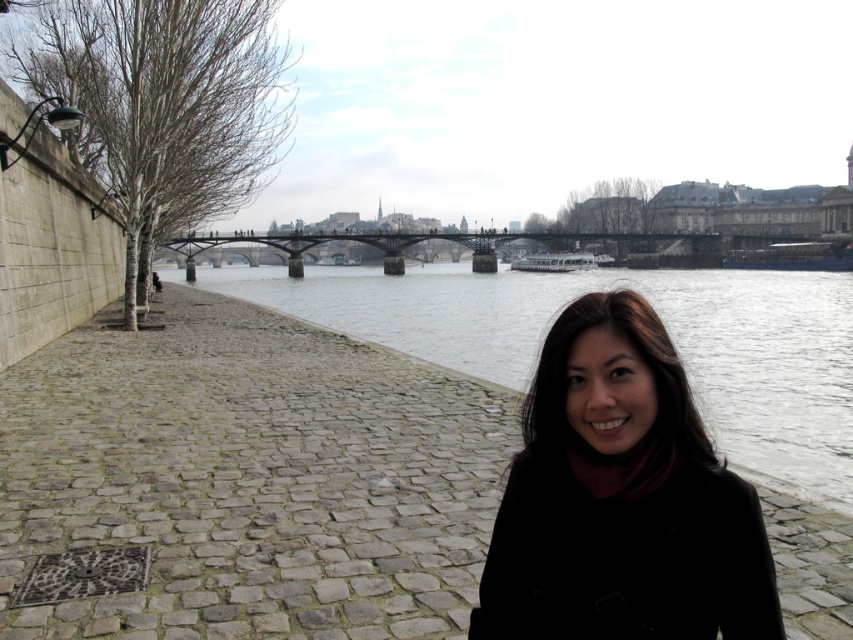
Question: Considering the real-world distances, which object is farthest from the black woolen coat at center?

Choices:
 (A) gray concrete river at center
 (B) metallic bridge at center

Answer: (B)

Question: Which of these objects is positioned farthest from the metallic bridge at center?

Choices:
 (A) black woolen coat at center
 (B) gray concrete river at center

Answer: (A)

Question: Does gray concrete river at center have a lesser width compared to metallic bridge at center?

Choices:
 (A) yes
 (B) no

Answer: (A)

Question: Is black woolen coat at center closer to camera compared to gray concrete river at center?

Choices:
 (A) no
 (B) yes

Answer: (B)

Question: Among these points, which one is nearest to the camera?

Choices:
 (A) (345, 232)
 (B) (672, 509)

Answer: (B)

Question: Can you confirm if gray concrete river at center is positioned to the left of metallic bridge at center?

Choices:
 (A) no
 (B) yes

Answer: (A)